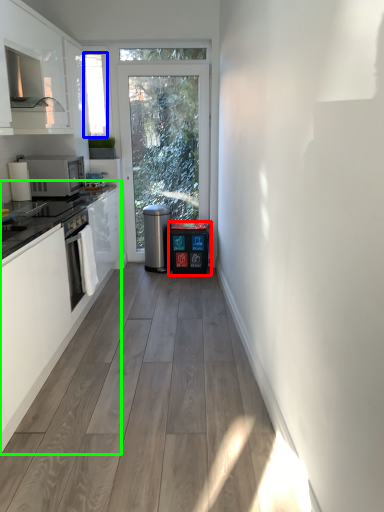
Question: Which object is positioned closest to dish washer (highlighted by a red box)? Select from window screen (highlighted by a blue box) and cabinetry (highlighted by a green box).

Choices:
 (A) window screen
 (B) cabinetry

Answer: (A)